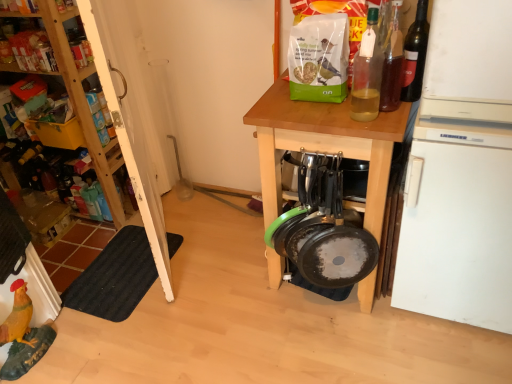
Image resolution: width=512 pixels, height=384 pixels. In order to click on black rubber mat at lower left in this screenshot , I will do `click(115, 277)`.

The height and width of the screenshot is (384, 512). What do you see at coordinates (415, 54) in the screenshot?
I see `dark glass bottle at upper right, which ranks as the 3th bottle in left-to-right order` at bounding box center [415, 54].

Locate an element on the screen. Image resolution: width=512 pixels, height=384 pixels. white matte refrigerator at right is located at coordinates (461, 172).

Where is `wooden shelves at left`? This screenshot has height=384, width=512. wooden shelves at left is located at coordinates (80, 99).

This screenshot has width=512, height=384. Identify the location of wooden table at center. (324, 145).

Which of these two, translucent glass bottle at upper right, the 3th bottle in the right-to-left sequence, or wooden shelves at left, is thinner?

translucent glass bottle at upper right, the 3th bottle in the right-to-left sequence.

Considering the sizes of objects translucent glass bottle at upper right, the 3th bottle in the right-to-left sequence, and wooden shelves at left in the image provided, who is taller, translucent glass bottle at upper right, the 3th bottle in the right-to-left sequence, or wooden shelves at left?

wooden shelves at left.

From a real-world perspective, is translucent glass bottle at upper right, the 1th bottle viewed from the left, physically above wooden shelves at left?

Yes, from a real-world perspective, translucent glass bottle at upper right, the 1th bottle viewed from the left, is over wooden shelves at left

Do you think translucent glass bottle at upper right, the 3th bottle in the right-to-left sequence, is within wooden shelves at left, or outside of it?

translucent glass bottle at upper right, the 3th bottle in the right-to-left sequence, lies outside wooden shelves at left.

Is point (394, 91) positioned before point (31, 41)?

Yes, it is in front of point (31, 41).

Is translucent glass bottle at upper right, marked as the second bottle in a right-to-left arrangement, shorter than wooden shelves at upper left?

Incorrect, the height of translucent glass bottle at upper right, marked as the second bottle in a right-to-left arrangement, does not fall short of that of wooden shelves at upper left.

Which object is positioned more to the left, translucent glass bottle at upper right, which is the second bottle in left-to-right order, or wooden shelves at upper left?

wooden shelves at upper left.

Consider the image. Considering the relative sizes of translucent glass bottle at upper right, which is the second bottle in left-to-right order, and wooden shelves at upper left in the image provided, is translucent glass bottle at upper right, which is the second bottle in left-to-right order, smaller than wooden shelves at upper left?

Correct, translucent glass bottle at upper right, which is the second bottle in left-to-right order, occupies less space than wooden shelves at upper left.

Is dark glass bottle at upper right, the 1th bottle in the right-to-left sequence, positioned with its back to translucent glass bottle at upper right, which is the second bottle in left-to-right order?

That's right, dark glass bottle at upper right, the 1th bottle in the right-to-left sequence, is facing away from translucent glass bottle at upper right, which is the second bottle in left-to-right order.

The height and width of the screenshot is (384, 512). Identify the location of the 1st bottle in front of the dark glass bottle at upper right, the 1th bottle in the right-to-left sequence, starting your count from the anchor. (392, 62).

Looking at this image, considering the relative sizes of dark glass bottle at upper right, which ranks as the 3th bottle in left-to-right order, and translucent glass bottle at upper right, marked as the second bottle in a right-to-left arrangement, in the image provided, is dark glass bottle at upper right, which ranks as the 3th bottle in left-to-right order, taller than translucent glass bottle at upper right, marked as the second bottle in a right-to-left arrangement,?

Yes.

From a real-world perspective, is dark glass bottle at upper right, the 1th bottle in the right-to-left sequence, positioned under translucent glass bottle at upper right, which is the second bottle in left-to-right order, based on gravity?

Yes, from a real-world perspective, dark glass bottle at upper right, the 1th bottle in the right-to-left sequence, is under translucent glass bottle at upper right, which is the second bottle in left-to-right order.

Can you tell me how much black rubber mat at lower left and wooden shelves at left differ in facing direction?

The angle between the facing direction of black rubber mat at lower left and the facing direction of wooden shelves at left is 86.9 degrees.

Does point (148, 285) appear closer or farther from the camera than point (79, 99)?

Clearly, point (148, 285) is more distant from the camera than point (79, 99).

Which is more to the left, black rubber mat at lower left or wooden shelves at left?

wooden shelves at left is more to the left.

From the image's perspective, is black rubber mat at lower left under wooden shelves at left?

Yes, from the image's perspective, black rubber mat at lower left is beneath wooden shelves at left.

Is wooden shelves at left behind translucent glass bottle at upper right, the 3th bottle in the right-to-left sequence?

Yes.

Which of these two, wooden shelves at left or translucent glass bottle at upper right, the 1th bottle viewed from the left, stands taller?

wooden shelves at left is taller.

Does point (77, 84) come closer to viewer compared to point (357, 74)?

No, (77, 84) is further to viewer.

Could you tell me if wooden shelves at upper left is facing translucent glass bottle at upper right, the 3th bottle in the right-to-left sequence?

No.

You are a GUI agent. You are given a task and a screenshot of the screen. Output one action in this format:
    pyautogui.click(x=<x>, y=<y>)
    Task: Click on the shelf above the translucent glass bottle at upper right, the 1th bottle viewed from the left (from the image's perspective)
    
    Given the screenshot: What is the action you would take?
    pyautogui.click(x=30, y=46)

From a real-world perspective, between wooden shelves at upper left and translucent glass bottle at upper right, the 1th bottle viewed from the left, who is vertically lower?

wooden shelves at upper left.

From the image's perspective, between wooden shelves at upper left and translucent glass bottle at upper right, the 1th bottle viewed from the left, who is located below?

From the image's view, translucent glass bottle at upper right, the 1th bottle viewed from the left, is below.

Is wooden shelves at upper left taller or shorter than wooden table at center?

Clearly, wooden shelves at upper left is shorter compared to wooden table at center.

Is wooden shelves at upper left inside or outside of wooden table at center?

The correct answer is: outside.

Is wooden shelves at upper left facing away from wooden table at center?

No, wooden shelves at upper left's orientation is not away from wooden table at center.

From the image's perspective, is wooden shelves at upper left located beneath wooden table at center?

Actually, wooden shelves at upper left appears above wooden table at center in the image.

This screenshot has height=384, width=512. What are the coordinates of `cabinetry on the left side of translucent glass bottle at upper right, the 3th bottle in the right-to-left sequence` in the screenshot? It's located at (80, 99).

Locate an element on the screen. shelf located above the translucent glass bottle at upper right, which is the second bottle in left-to-right order (from the image's perspective) is located at coordinates (30, 46).

Which object lies further to the anchor point black rubber mat at lower left, translucent glass bottle at upper right, which is the second bottle in left-to-right order, or wooden shelves at upper left?

translucent glass bottle at upper right, which is the second bottle in left-to-right order, lies further to black rubber mat at lower left than the other object.

Based on their spatial positions, is translucent glass bottle at upper right, the 1th bottle viewed from the left, or translucent glass bottle at upper right, marked as the second bottle in a right-to-left arrangement, closer to dark glass bottle at upper right, the 1th bottle in the right-to-left sequence?

translucent glass bottle at upper right, marked as the second bottle in a right-to-left arrangement, lies closer to dark glass bottle at upper right, the 1th bottle in the right-to-left sequence, than the other object.

Which object lies further to the anchor point black rubber mat at lower left, dark glass bottle at upper right, which ranks as the 3th bottle in left-to-right order, or wooden shelves at upper left?

dark glass bottle at upper right, which ranks as the 3th bottle in left-to-right order, is positioned further to the anchor black rubber mat at lower left.

Considering their positions, is black rubber mat at lower left positioned further to wooden table at center than translucent glass bottle at upper right, which is the second bottle in left-to-right order?

The object further to wooden table at center is black rubber mat at lower left.

Which object lies nearer to the anchor point wooden shelves at left, wooden shelves at upper left or dark glass bottle at upper right, which ranks as the 3th bottle in left-to-right order?

wooden shelves at upper left is positioned closer to the anchor wooden shelves at left.

Which object lies nearer to the anchor point translucent glass bottle at upper right, marked as the second bottle in a right-to-left arrangement, wooden shelves at upper left or wooden shelves at left?

Based on the image, wooden shelves at left appears to be nearer to translucent glass bottle at upper right, marked as the second bottle in a right-to-left arrangement.

From the image, which object appears to be farther from translucent glass bottle at upper right, which is the second bottle in left-to-right order, dark glass bottle at upper right, which ranks as the 3th bottle in left-to-right order, or wooden shelves at left?

wooden shelves at left lies further to translucent glass bottle at upper right, which is the second bottle in left-to-right order, than the other object.

Consider the image. Considering their positions, is wooden shelves at left positioned closer to wooden shelves at upper left than translucent glass bottle at upper right, the 3th bottle in the right-to-left sequence?

The object closer to wooden shelves at upper left is wooden shelves at left.

At what (x,y) coordinates should I click in order to perform the action: click on shelf located between wooden shelves at left and wooden table at center in the left-right direction. Please return your answer as a coordinate pair (x, y). Looking at the image, I should click on [30, 46].

Locate an element on the screen. The image size is (512, 384). bottle between wooden shelves at left and wooden table at center from left to right is located at coordinates (367, 72).

Where is `mat between wooden shelves at upper left and translucent glass bottle at upper right, the 3th bottle in the right-to-left sequence, in the horizontal direction`? mat between wooden shelves at upper left and translucent glass bottle at upper right, the 3th bottle in the right-to-left sequence, in the horizontal direction is located at coordinates (115, 277).

Find the location of a particular element. The height and width of the screenshot is (384, 512). desk between wooden shelves at left and white matte refrigerator at right in the horizontal direction is located at coordinates (x=324, y=145).